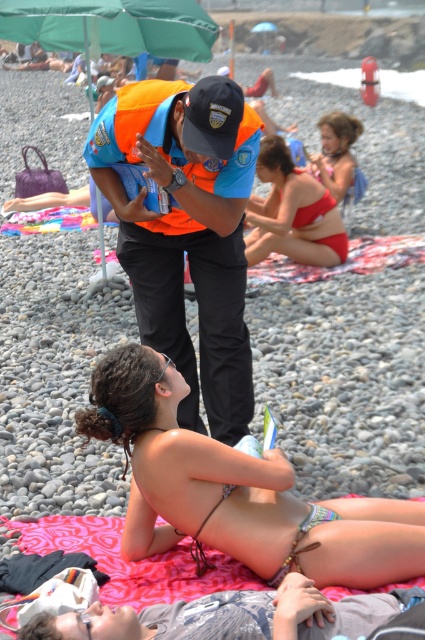
Question: Does pink fabric blanket at lower center have a lesser width compared to red bikini bottom at center?

Choices:
 (A) no
 (B) yes

Answer: (A)

Question: Is orange uniform at center thinner than matte red bikini at upper right?

Choices:
 (A) yes
 (B) no

Answer: (B)

Question: Which object is farther from the camera taking this photo?

Choices:
 (A) multicolored bikini at center
 (B) orange uniform at center
 (C) red bikini bottom at center
 (D) matte red bikini at upper right

Answer: (D)

Question: Which is farther from the gray cotton shirt at lower center?

Choices:
 (A) green fabric umbrella at upper center
 (B) pink fabric blanket at lower center
 (C) red bikini bottom at center

Answer: (A)

Question: Does pink fabric blanket at lower center come behind matte red bikini at upper right?

Choices:
 (A) yes
 (B) no

Answer: (B)

Question: Among these points, which one is nearest to the camera?

Choices:
 (A) (269, 454)
 (B) (280, 621)
 (C) (5, 600)
 (D) (76, 1)

Answer: (B)